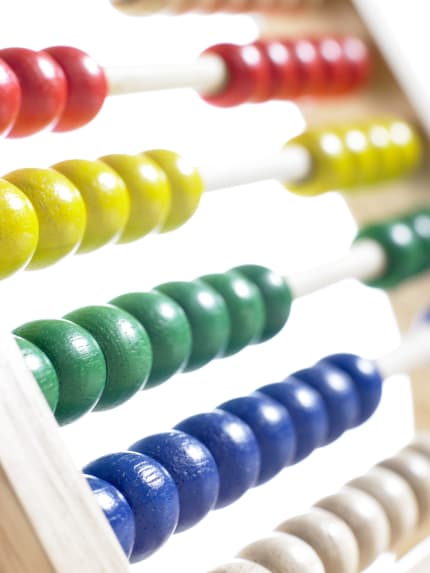
Where is `white abacus beads`? The width and height of the screenshot is (430, 573). white abacus beads is located at coordinates (427, 452), (421, 466), (401, 493), (373, 521), (331, 545), (300, 559), (248, 571).